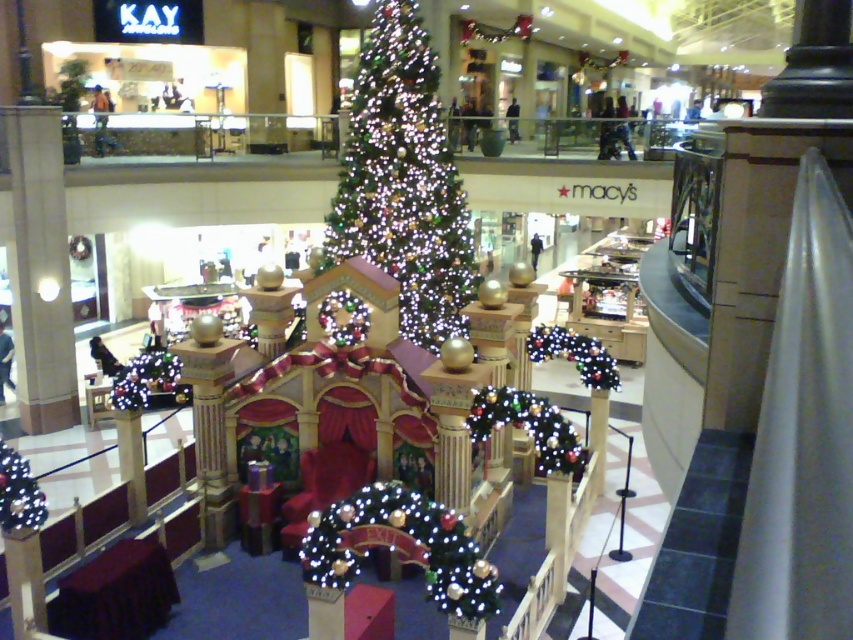
Which is above, iridescent glass christmas tree at center or illuminated garland at center?

Positioned higher is iridescent glass christmas tree at center.

This screenshot has height=640, width=853. Describe the element at coordinates (403, 180) in the screenshot. I see `iridescent glass christmas tree at center` at that location.

I want to click on iridescent glass christmas tree at center, so click(403, 180).

Which is in front, point (547, 451) or point (20, 524)?

Point (20, 524) is in front.

This screenshot has width=853, height=640. What do you see at coordinates (529, 428) in the screenshot? I see `illuminated garland at center` at bounding box center [529, 428].

Between point (537, 401) and point (25, 484), which one is positioned behind?

Point (537, 401)

This screenshot has height=640, width=853. I want to click on illuminated garland at center, so click(529, 428).

Does illuminated fabric archway at center lie behind illuminated garland at center?

No.

Is illuminated fabric archway at center smaller than illuminated garland at center?

Incorrect, illuminated fabric archway at center is not smaller in size than illuminated garland at center.

Image resolution: width=853 pixels, height=640 pixels. What do you see at coordinates (399, 547) in the screenshot?
I see `illuminated fabric archway at center` at bounding box center [399, 547].

Find the location of a particular element. The height and width of the screenshot is (640, 853). illuminated fabric archway at center is located at coordinates (399, 547).